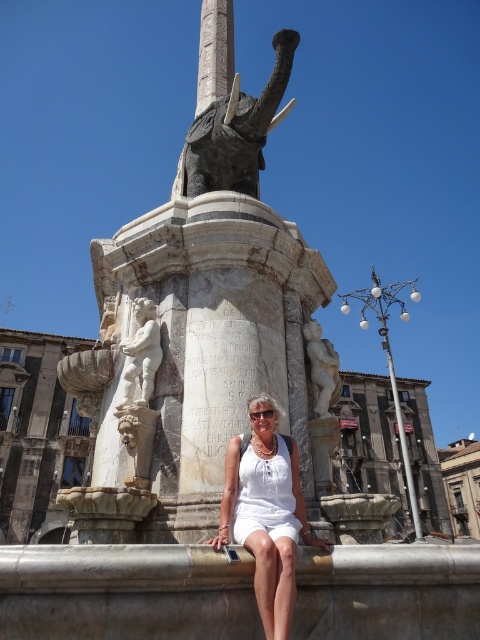
Is white marble cherub at lower left shorter than white marble cherub at center?

No.

Can you confirm if white marble cherub at lower left is positioned below white marble cherub at center?

No, white marble cherub at lower left is not below white marble cherub at center.

The image size is (480, 640). What are the coordinates of `white marble cherub at lower left` in the screenshot? It's located at (141, 353).

This screenshot has height=640, width=480. I want to click on white marble cherub at lower left, so click(x=141, y=353).

Is white fabric at center shorter than white marble cherub at center?

Incorrect, white fabric at center's height does not fall short of white marble cherub at center's.

Who is more forward, (280,442) or (324,397)?

Point (280,442)

Between point (274, 422) and point (321, 362), which one is positioned behind?

The point (321, 362) is behind.

Where is `white fabric at center`? This screenshot has width=480, height=640. white fabric at center is located at coordinates (265, 512).

Which is below, polished stone elephant at center or white marble cherub at lower left?

polished stone elephant at center is lower down.

Which is more to the right, polished stone elephant at center or white marble cherub at lower left?

From the viewer's perspective, white marble cherub at lower left appears more on the right side.

At what (x,y) coordinates should I click in order to perform the action: click on polished stone elephant at center. Please return your answer as a coordinate pair (x, y). Image resolution: width=480 pixels, height=640 pixels. Looking at the image, I should click on pyautogui.click(x=202, y=321).